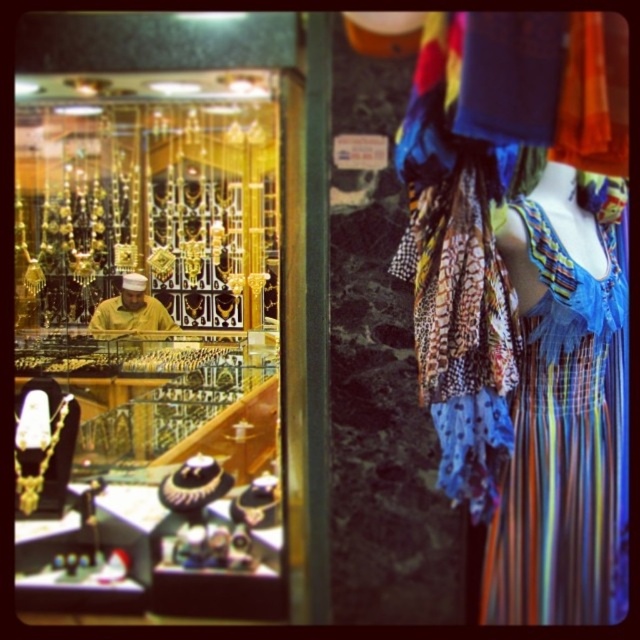
You are a tailor who needs to decide which fabric to use for a new dress design. You have two options in front of you, the multicolored striped dress at center and the yellow fabric at center. Based on their sizes, which one would you choose if you want to create a larger dress?

The multicolored striped dress at center is bigger than the yellow fabric at center, so you should choose the multicolored striped dress at center for creating a larger dress.

You are a customer in the marketplace and want to buy a necklace. You see the point at coordinates [148,346]. Is this point located on the gold jewelry display or the mannequin?

The point at [148,346] is located on the gold jewelry display.